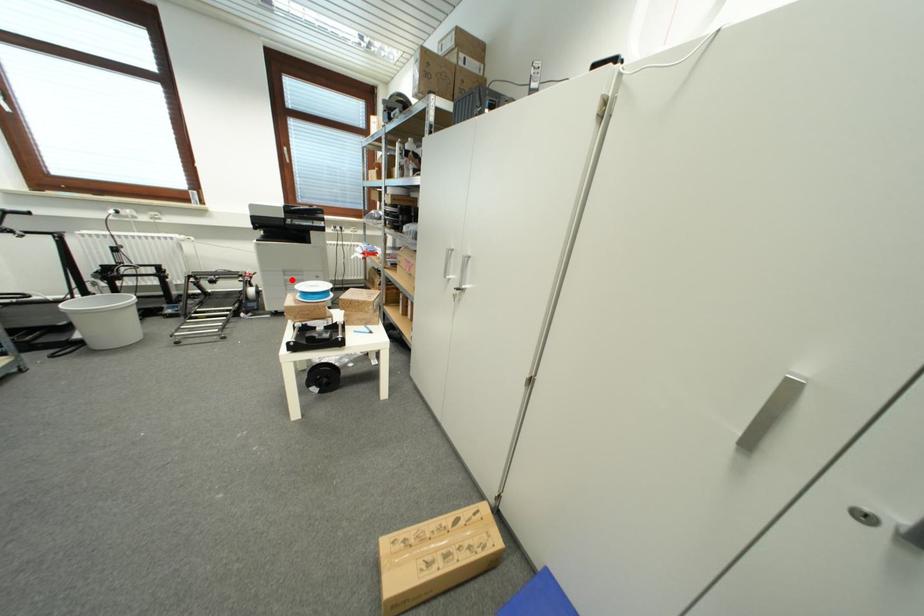
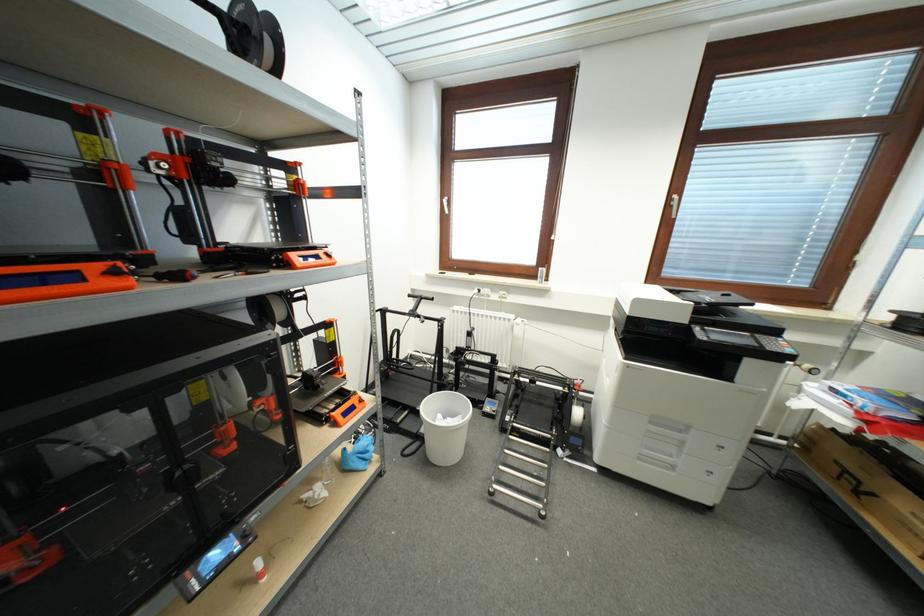
Question: I am providing you with two images of the same scene from different viewpoints. A red point is shown in image1. For the corresponding object point in image2, is it positioned nearer or farther from the camera?

Choices:
 (A) Nearer
 (B) Farther

Answer: (A)